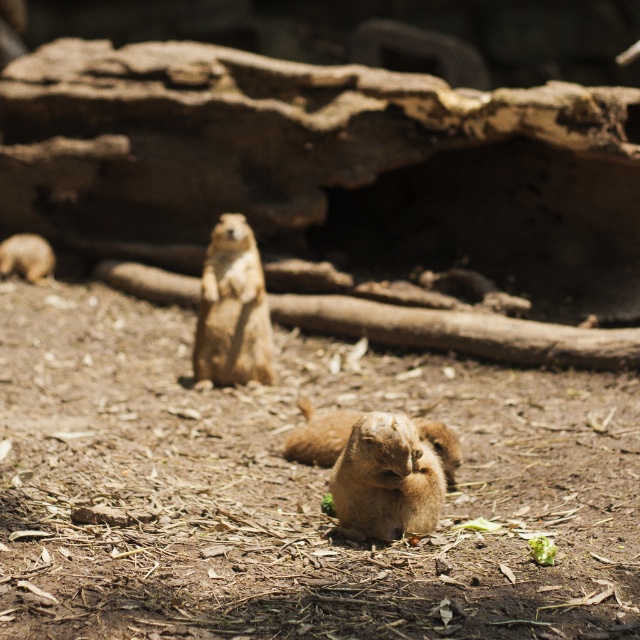
Question: In this image, where is fuzzy brown squirrel at center located relative to brown furry squirrel at left?

Choices:
 (A) left
 (B) right

Answer: (B)

Question: Which of the following is the farthest from the observer?

Choices:
 (A) fuzzy brown squirrel at center
 (B) brown furry squirrel at left
 (C) golden fur squirrel at center

Answer: (B)

Question: Is golden fur squirrel at center to the left of fuzzy brown squirrel at center from the viewer's perspective?

Choices:
 (A) no
 (B) yes

Answer: (B)

Question: Which of the following is the farthest from the observer?

Choices:
 (A) golden fur squirrel at center
 (B) brown furry squirrel at left
 (C) fuzzy brown squirrel at center

Answer: (B)

Question: Can you confirm if fuzzy brown squirrel at center is positioned above brown furry squirrel at left?

Choices:
 (A) yes
 (B) no

Answer: (B)

Question: Which object appears closest to the camera in this image?

Choices:
 (A) fuzzy brown squirrel at center
 (B) golden fur squirrel at center

Answer: (A)